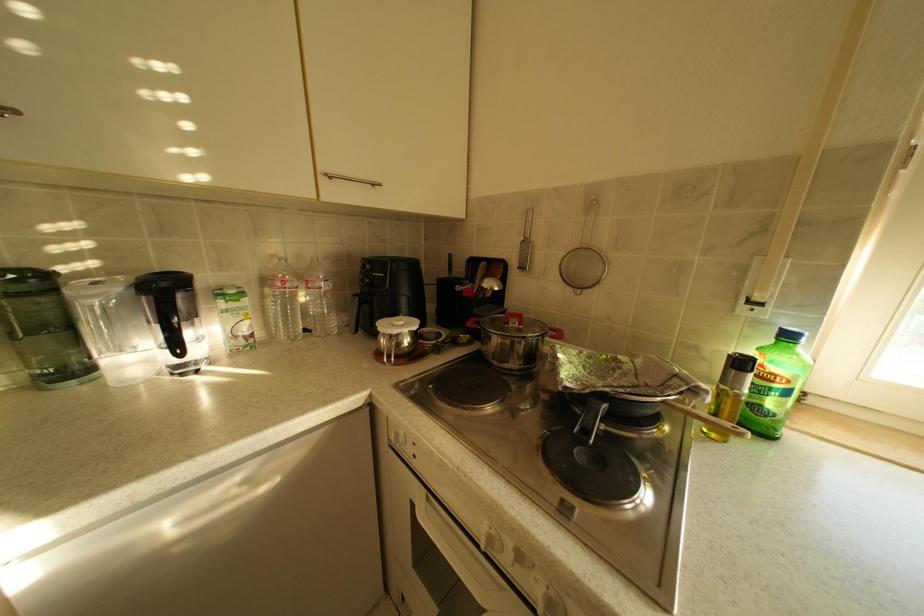
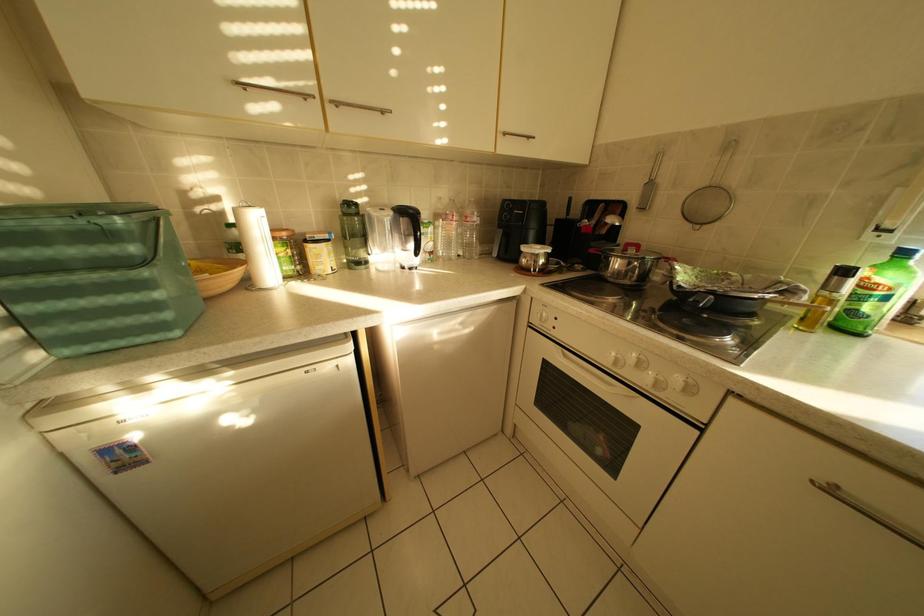
Question: How did the camera likely rotate?

Choices:
 (A) Left
 (B) Right
 (C) Up
 (D) Down

Answer: (A)